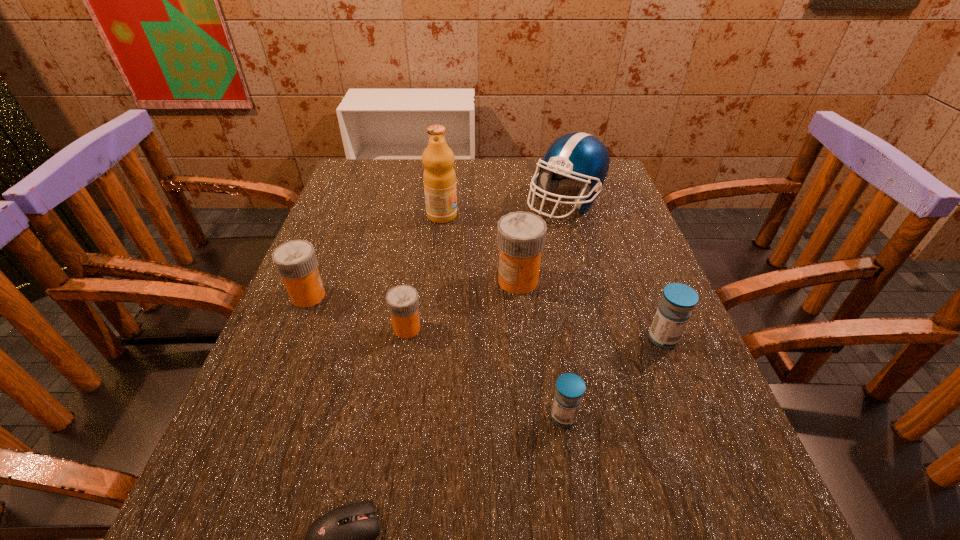
This screenshot has width=960, height=540. In order to click on vacant space situated 0.150m on the label side of the second medicine from left to right in this screenshot , I will do `click(497, 328)`.

Find the location of `blank space located 0.070m on the right of the second nearest object`. blank space located 0.070m on the right of the second nearest object is located at coordinates (619, 417).

Locate an element on the screen. The image size is (960, 540). object situated at the far edge is located at coordinates (578, 159).

Locate an element on the screen. Image resolution: width=960 pixels, height=540 pixels. object present at the left edge is located at coordinates (296, 262).

The width and height of the screenshot is (960, 540). What are the coordinates of `football helmet at the right edge` in the screenshot? It's located at (578, 159).

Locate an element on the screen. The width and height of the screenshot is (960, 540). medicine present at the right edge is located at coordinates (678, 300).

Find the location of a particular element. Image resolution: width=960 pixels, height=540 pixels. object that is at the far right corner is located at coordinates (578, 159).

Locate an element on the screen. Image resolution: width=960 pixels, height=540 pixels. vacant area at the far edge of the desktop is located at coordinates [x=480, y=199].

Find the location of a particular element. free location at the left edge of the desktop is located at coordinates (324, 424).

Where is `free space at the right edge of the desktop`? free space at the right edge of the desktop is located at coordinates (655, 295).